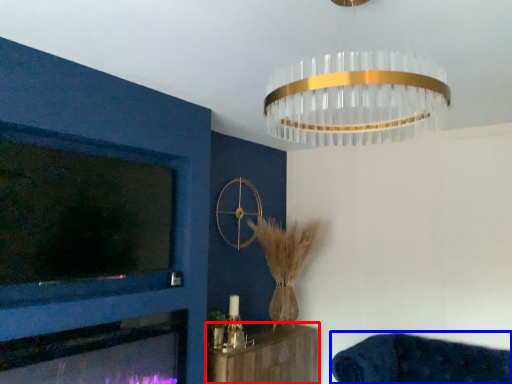
Question: Which of the following is the farthest to the observer, furniture (highlighted by a red box) or furniture (highlighted by a blue box)?

Choices:
 (A) furniture
 (B) furniture

Answer: (A)